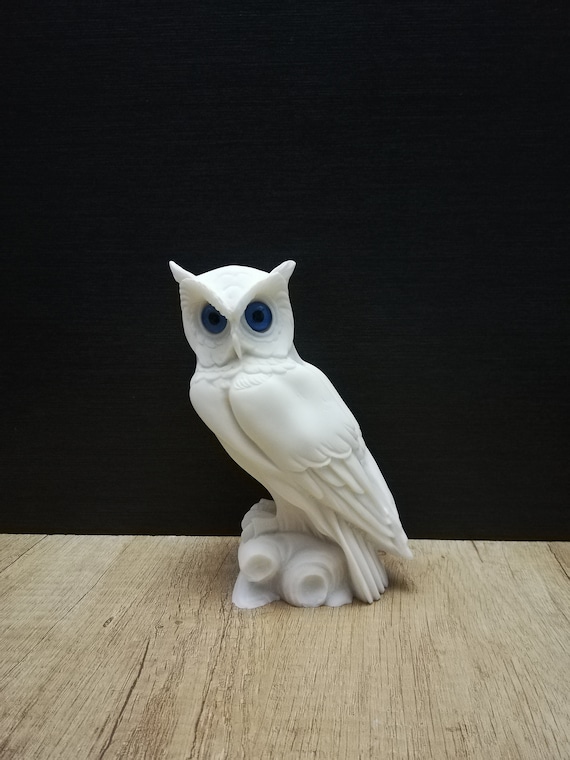
I want to click on black wall, so click(429, 268).